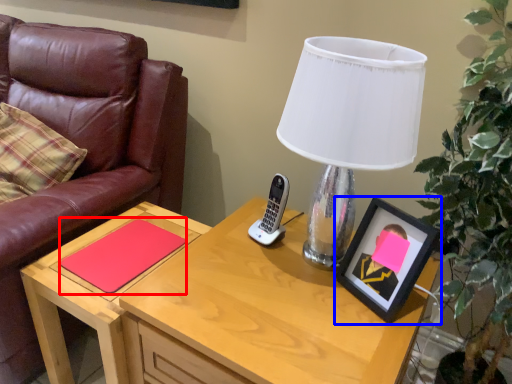
Question: Among these objects, which one is nearest to the camera, notepad (highlighted by a red box) or picture frame (highlighted by a blue box)?

Choices:
 (A) notepad
 (B) picture frame

Answer: (B)